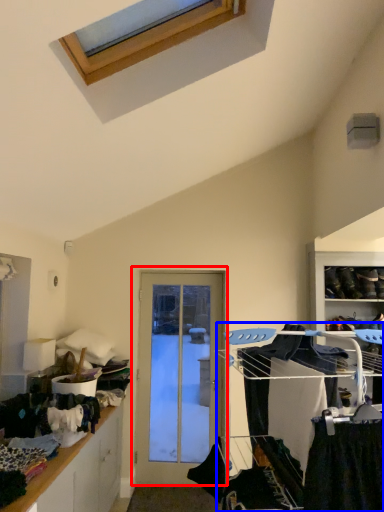
Question: Which of the following is the closest to the observer, door (highlighted by a red box) or bunk bed (highlighted by a blue box)?

Choices:
 (A) door
 (B) bunk bed

Answer: (B)